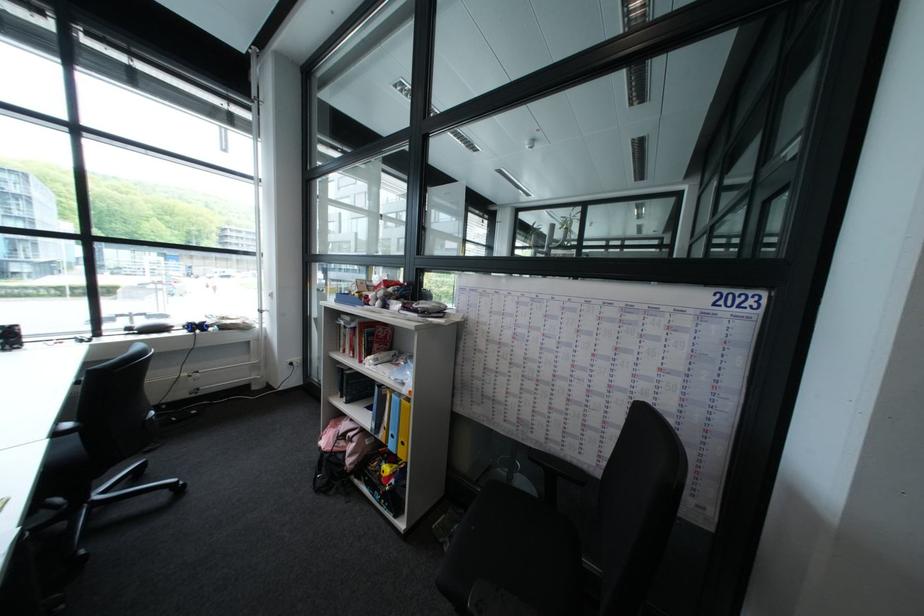
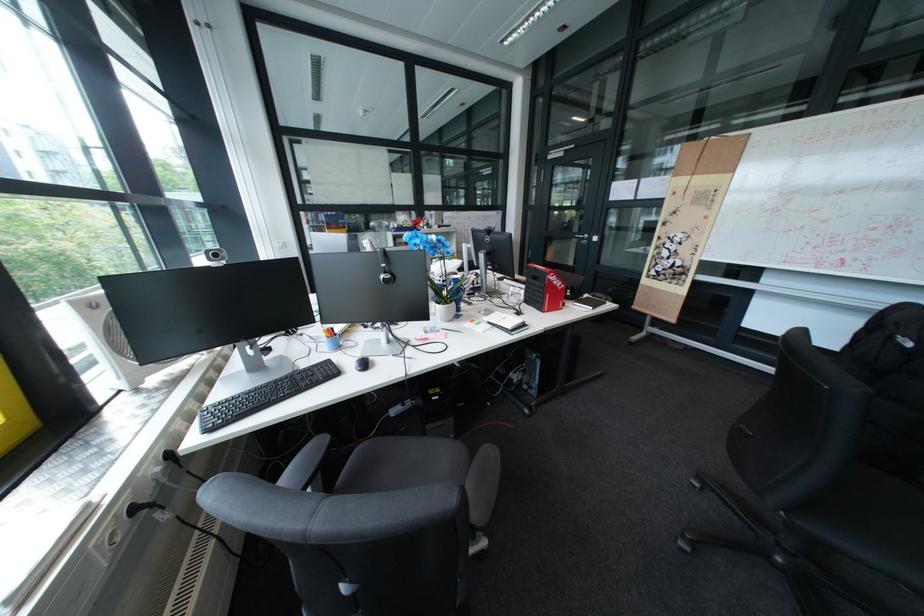
Question: I am providing you with two images of the same scene from different viewpoints. Please identify which objects are invisible in image2.

Choices:
 (A) silver door handle
 (B) silver stapler
 (C) gaming controller
 (D) small black notebook

Answer: (C)